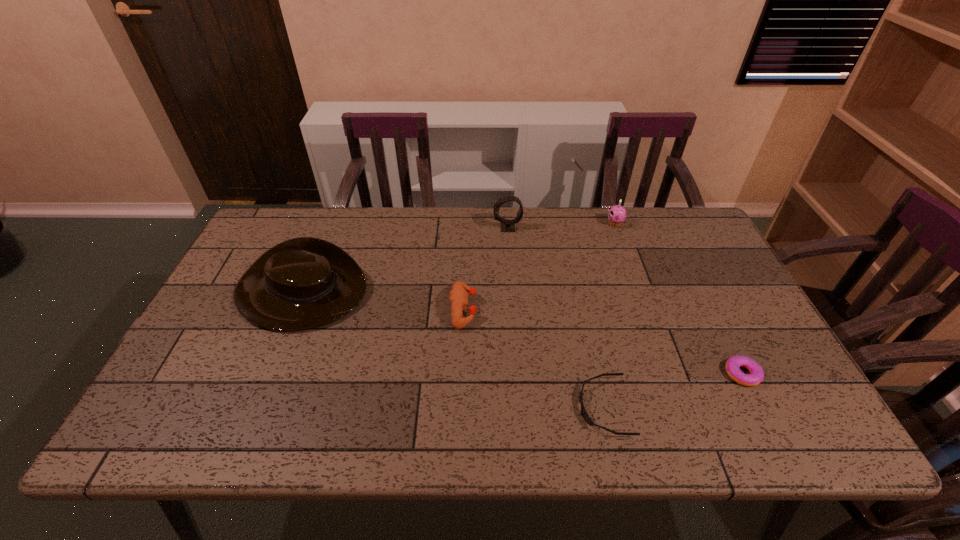
Identify the location of watch. The width and height of the screenshot is (960, 540). (506, 225).

Where is `the third object from left to right`? the third object from left to right is located at coordinates (506, 225).

Identify the location of cupcake. (616, 214).

Image resolution: width=960 pixels, height=540 pixels. I want to click on the leftmost object, so click(x=302, y=283).

Locate an element on the screen. the second object from left to right is located at coordinates (458, 295).

The height and width of the screenshot is (540, 960). I want to click on the third shortest object, so click(x=458, y=295).

You are a GUI agent. You are given a task and a screenshot of the screen. Output one action in this format:
    pyautogui.click(x=<x>, y=<y>)
    Task: Click on the rightmost object
    This screenshot has height=540, width=960.
    Given the screenshot: What is the action you would take?
    pyautogui.click(x=733, y=364)

Image resolution: width=960 pixels, height=540 pixels. I want to click on the shortest object, so click(586, 417).

You are a GUI agent. You are given a task and a screenshot of the screen. Output one action in this format:
    pyautogui.click(x=<x>, y=<y>)
    Task: Click on the fourth object from left to right
    This screenshot has height=540, width=960.
    Given the screenshot: What is the action you would take?
    [586, 417]

Where is `vacant position located 0.140m on the face of the fourth object from right to left`? The image size is (960, 540). vacant position located 0.140m on the face of the fourth object from right to left is located at coordinates (451, 228).